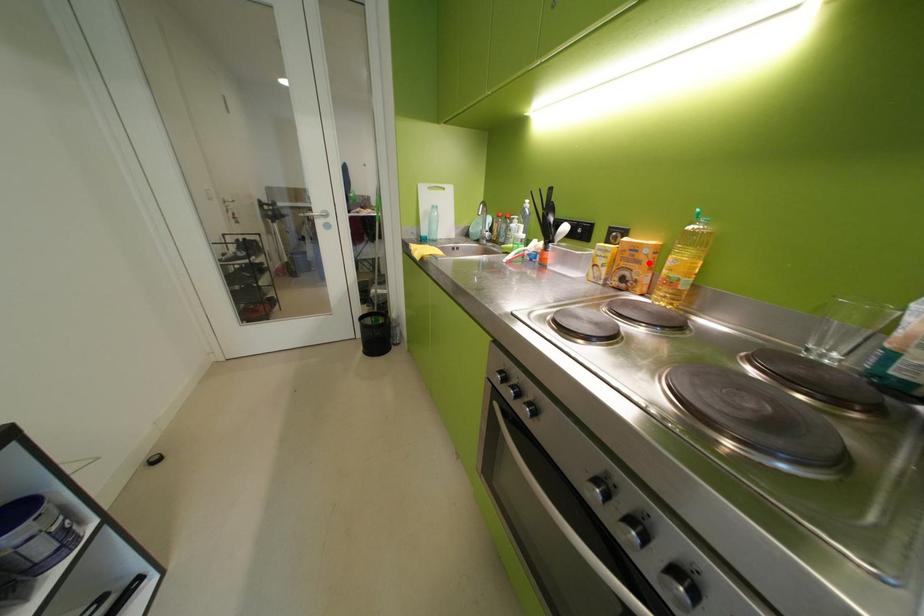
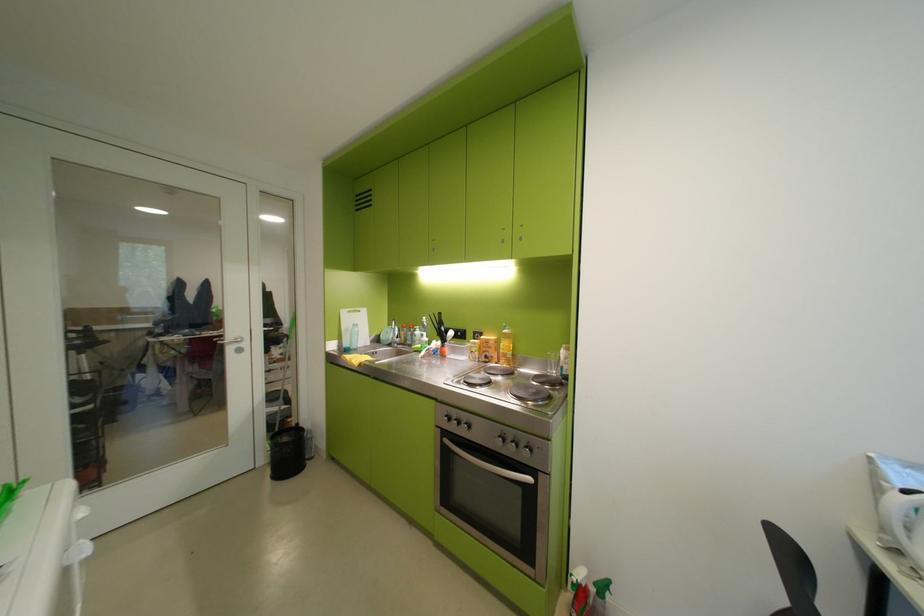
Locate, in the second image, the point that corresponds to the highlighted location in the first image.

(501, 349)